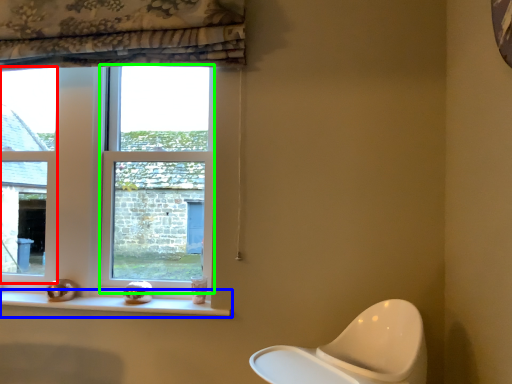
Question: Which object is positioned closest to window (highlighted by a red box)? Select from window sill (highlighted by a blue box) and window (highlighted by a green box).

Choices:
 (A) window sill
 (B) window

Answer: (B)